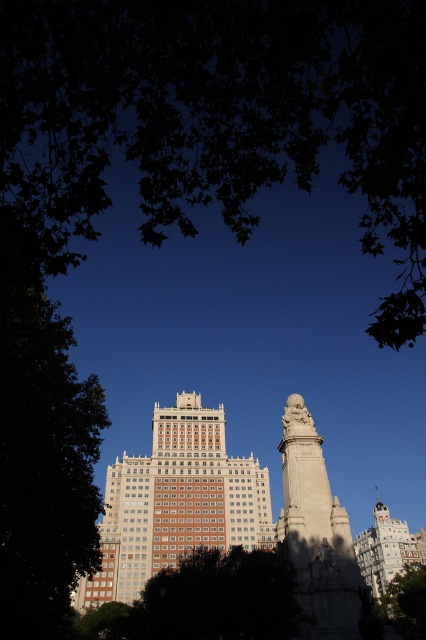
Can you confirm if white brick building at center is positioned to the right of white stone statue at center?

In fact, white brick building at center is to the left of white stone statue at center.

Can you confirm if white brick building at center is positioned to the left of white stone statue at center?

Indeed, white brick building at center is positioned on the left side of white stone statue at center.

Describe the element at coordinates (175, 502) in the screenshot. The image size is (426, 640). I see `white brick building at center` at that location.

The image size is (426, 640). I want to click on white brick building at center, so click(x=175, y=502).

Consider the image. How far apart are green leafy tree at lower right and white marble statue at center?

They are 54.34 meters apart.

Is point (414, 611) in front of point (299, 403)?

No.

At what (x,y) coordinates should I click in order to perform the action: click on green leafy tree at lower right. Please return your answer as a coordinate pair (x, y). The width and height of the screenshot is (426, 640). Looking at the image, I should click on (405, 602).

In the scene shown: Can you confirm if white stone monument at center is bigger than white stone statue at center?

Yes, white stone monument at center is bigger than white stone statue at center.

What do you see at coordinates (316, 531) in the screenshot? The image size is (426, 640). I see `white stone monument at center` at bounding box center [316, 531].

This screenshot has width=426, height=640. Identify the location of white stone monument at center. (316, 531).